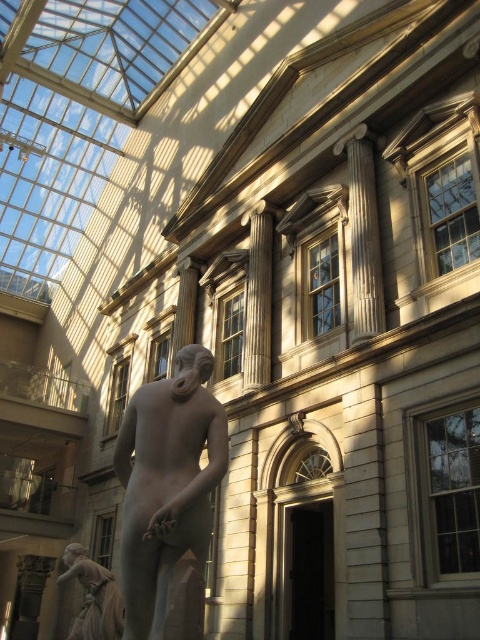
Question: Which point appears farthest from the camera in this image?

Choices:
 (A) (119, 600)
 (B) (178, 484)

Answer: (A)

Question: Which point is farther to the camera?

Choices:
 (A) matte bronze statue at lower left
 (B) matte gray statue at center

Answer: (A)

Question: Among these points, which one is farthest from the camera?

Choices:
 (A) (149, 572)
 (B) (60, 580)

Answer: (B)

Question: Considering the relative positions of matte gray statue at center and matte bronze statue at lower left in the image provided, where is matte gray statue at center located with respect to matte bronze statue at lower left?

Choices:
 (A) left
 (B) right

Answer: (B)

Question: Does matte gray statue at center come in front of matte bronze statue at lower left?

Choices:
 (A) no
 (B) yes

Answer: (B)

Question: In this image, where is matte gray statue at center located relative to matte bronze statue at lower left?

Choices:
 (A) above
 (B) below

Answer: (A)